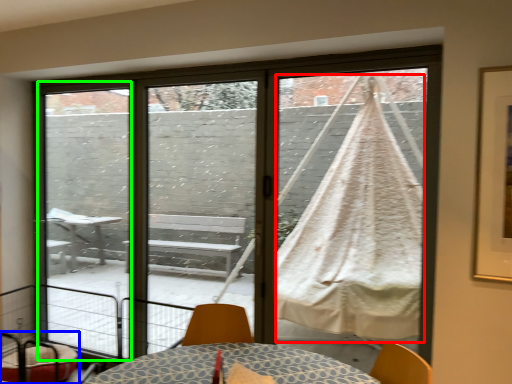
Question: Which is nearer to the blanket (highlighted by a red box)? furniture (highlighted by a blue box) or screen door (highlighted by a green box).

Choices:
 (A) furniture
 (B) screen door

Answer: (B)